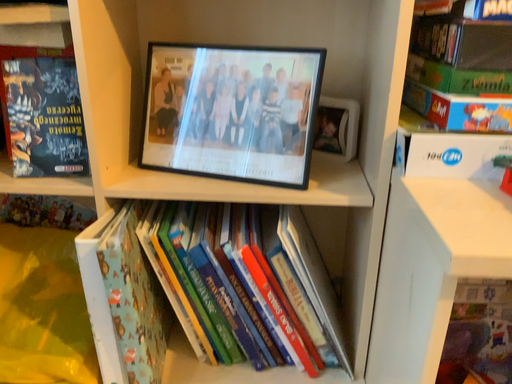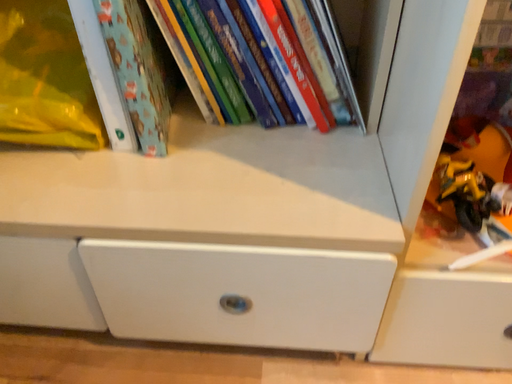
Question: How did the camera likely rotate when shooting the video?

Choices:
 (A) rotated downward
 (B) rotated upward

Answer: (A)